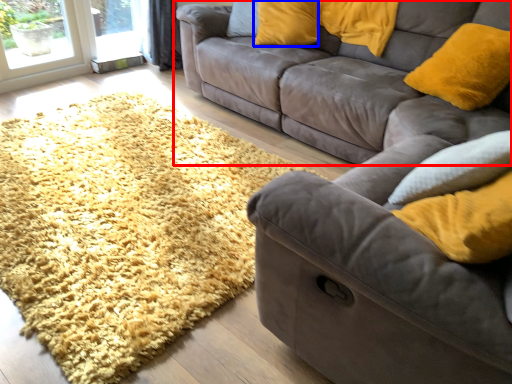
Question: Which of the following is the farthest to the observer, studio couch (highlighted by a red box) or pillow (highlighted by a blue box)?

Choices:
 (A) studio couch
 (B) pillow

Answer: (B)